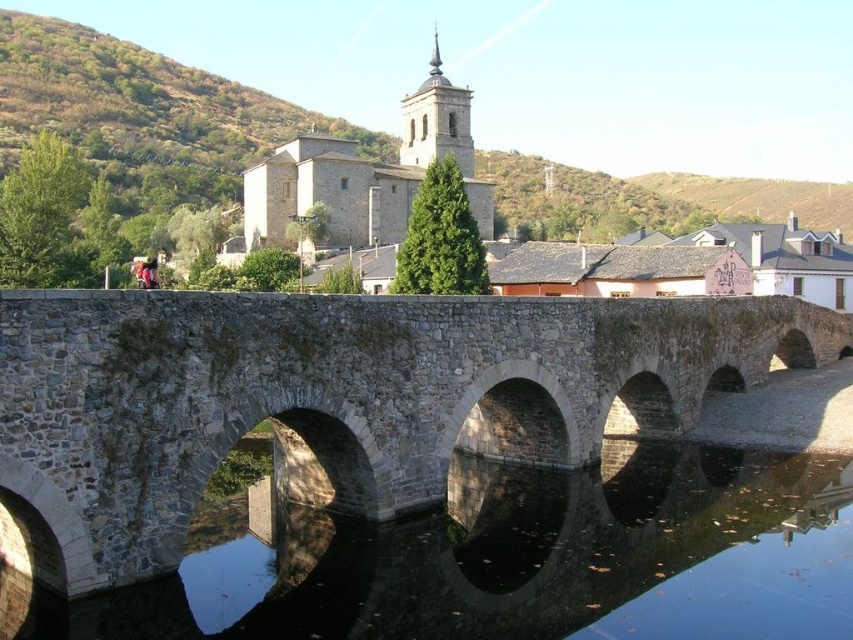
Question: Among these objects, which one is nearest to the camera?

Choices:
 (A) stone bridge at center
 (B) black stone water at center

Answer: (A)

Question: Does stone bridge at center appear on the right side of black stone water at center?

Choices:
 (A) yes
 (B) no

Answer: (A)

Question: Is stone bridge at center closer to camera compared to black stone water at center?

Choices:
 (A) yes
 (B) no

Answer: (A)

Question: Can you confirm if stone bridge at center is positioned to the left of black stone water at center?

Choices:
 (A) yes
 (B) no

Answer: (B)